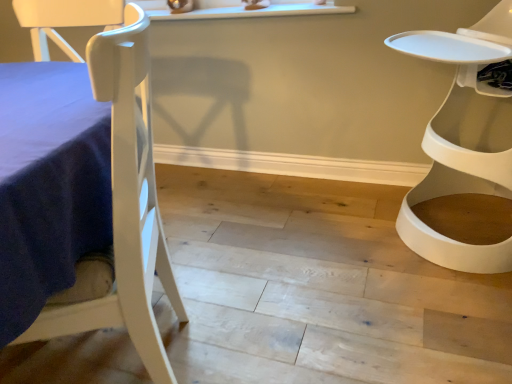
Question: Is white matte chair at left, marked as the 1th chair in a left-to-right arrangement, completely or partially inside white plastic chair at right, which appears as the first chair when viewed from the right?

Choices:
 (A) no
 (B) yes

Answer: (A)

Question: Is white plastic chair at right, the second chair in the left-to-right sequence, to the left of white matte chair at left, marked as the 1th chair in a left-to-right arrangement, from the viewer's perspective?

Choices:
 (A) no
 (B) yes

Answer: (A)

Question: Can you confirm if white plastic chair at right, which appears as the first chair when viewed from the right, is positioned to the right of white matte chair at left, which is counted as the 2th chair, starting from the right?

Choices:
 (A) yes
 (B) no

Answer: (A)

Question: Are white plastic chair at right, which appears as the first chair when viewed from the right, and white matte chair at left, which is counted as the 2th chair, starting from the right, far apart?

Choices:
 (A) no
 (B) yes

Answer: (B)

Question: From a real-world perspective, is white plastic chair at right, which appears as the first chair when viewed from the right, over white matte chair at left, which is counted as the 2th chair, starting from the right?

Choices:
 (A) no
 (B) yes

Answer: (A)

Question: From the image's perspective, is white plastic chair at right, the second chair in the left-to-right sequence, located above white matte chair at left, marked as the 1th chair in a left-to-right arrangement?

Choices:
 (A) no
 (B) yes

Answer: (B)

Question: Is white plastic chair at right, the second chair in the left-to-right sequence, at the back of white matte chair at left, which is counted as the 2th chair, starting from the right?

Choices:
 (A) yes
 (B) no

Answer: (B)

Question: Is white matte chair at left, marked as the 1th chair in a left-to-right arrangement, not inside white plastic chair at right, which appears as the first chair when viewed from the right?

Choices:
 (A) no
 (B) yes

Answer: (B)

Question: Is white matte chair at left, marked as the 1th chair in a left-to-right arrangement, at the left side of white plastic chair at right, which appears as the first chair when viewed from the right?

Choices:
 (A) no
 (B) yes

Answer: (B)

Question: Considering the relative sizes of white matte chair at left, which is counted as the 2th chair, starting from the right, and white plastic chair at right, which appears as the first chair when viewed from the right, in the image provided, is white matte chair at left, which is counted as the 2th chair, starting from the right, thinner than white plastic chair at right, which appears as the first chair when viewed from the right,?

Choices:
 (A) no
 (B) yes

Answer: (B)

Question: Does white matte chair at left, marked as the 1th chair in a left-to-right arrangement, come in front of white plastic chair at right, the second chair in the left-to-right sequence?

Choices:
 (A) no
 (B) yes

Answer: (B)

Question: Considering the relative sizes of white matte chair at left, marked as the 1th chair in a left-to-right arrangement, and white plastic chair at right, which appears as the first chair when viewed from the right, in the image provided, is white matte chair at left, marked as the 1th chair in a left-to-right arrangement, taller than white plastic chair at right, which appears as the first chair when viewed from the right,?

Choices:
 (A) yes
 (B) no

Answer: (A)

Question: In the image, is white plastic chair at right, the second chair in the left-to-right sequence, on the left side or the right side of white matte chair at left, which is counted as the 2th chair, starting from the right?

Choices:
 (A) right
 (B) left

Answer: (A)